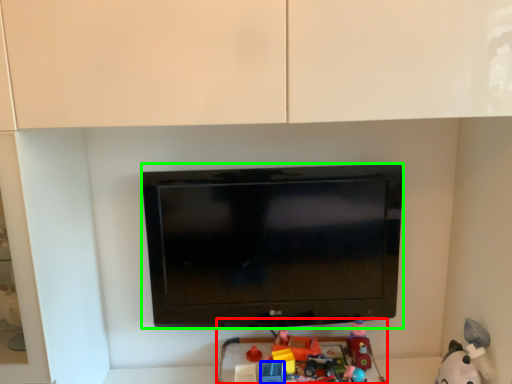
Question: Estimate the real-world distances between objects in this image. Which object is farther from toy (highlighted by a red box), toy (highlighted by a blue box) or television (highlighted by a green box)?

Choices:
 (A) toy
 (B) television

Answer: (B)